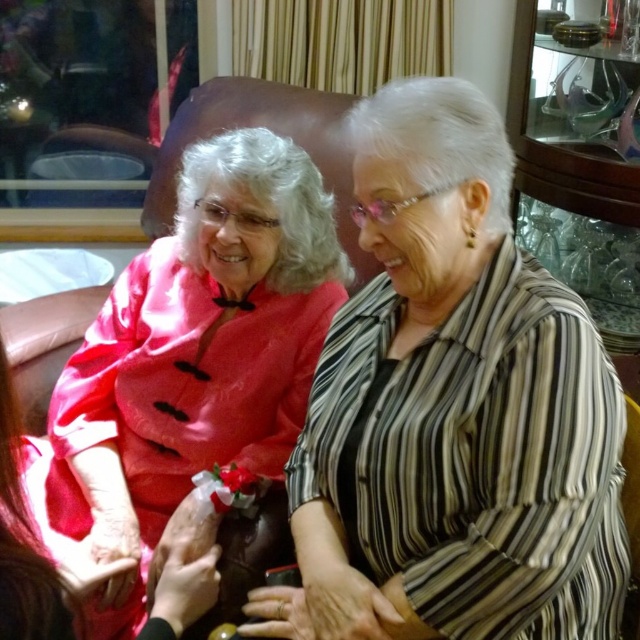
Measure the distance from striped fabric at center to silky pink dress at center.

striped fabric at center is 16.12 inches from silky pink dress at center.

Does striped fabric at center appear under silky pink dress at center?

Correct, striped fabric at center is located below silky pink dress at center.

Between point (529, 394) and point (188, 435), which one is positioned in front?

Point (529, 394) is in front.

At what (x,y) coordinates should I click in order to perform the action: click on striped fabric at center. Please return your answer as a coordinate pair (x, y). The height and width of the screenshot is (640, 640). Looking at the image, I should click on (452, 410).